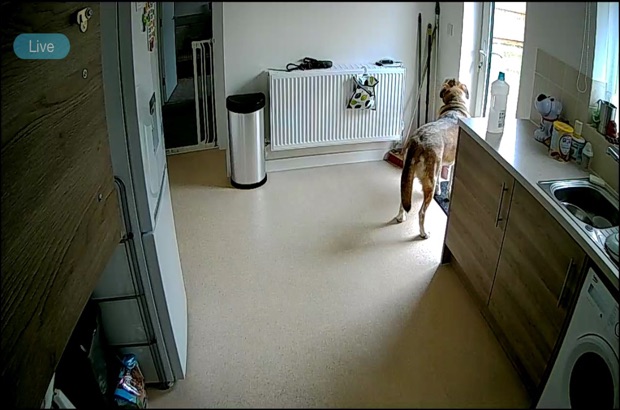
Find the location of a particular element. The width and height of the screenshot is (620, 410). beige floor is located at coordinates (403, 251).